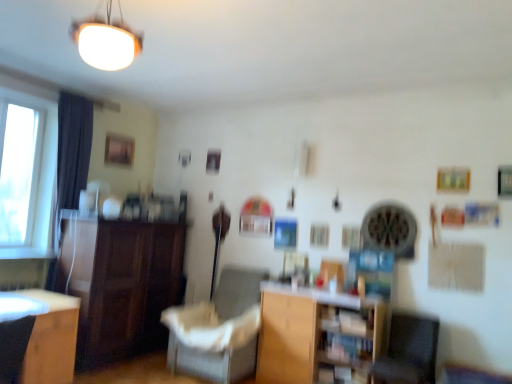
What are the coordinates of `free space above wooden desk at lower left (from a real-world perspective)` in the screenshot? It's located at (23, 300).